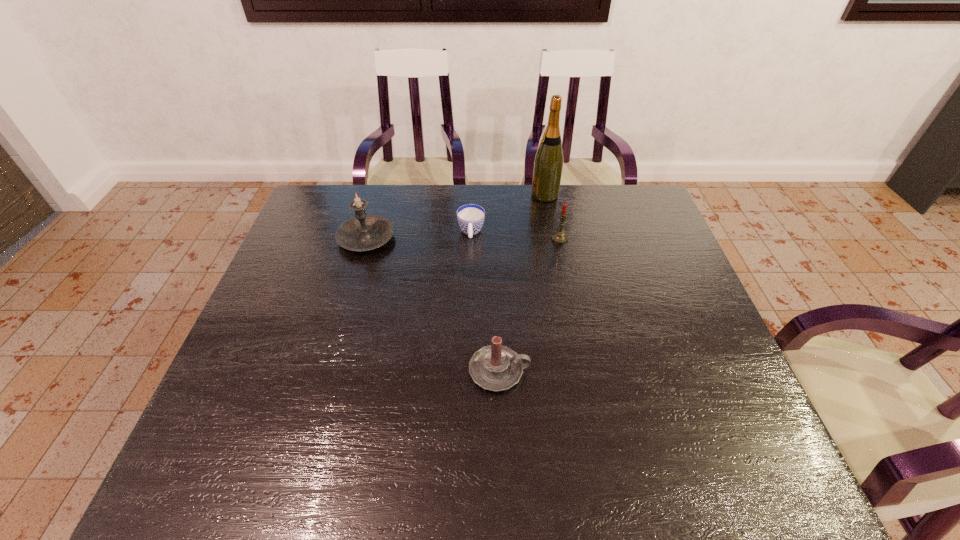
Where is `blank region between the tallest object and the rightmost candle`? blank region between the tallest object and the rightmost candle is located at coordinates (552, 217).

Identify the location of blank region between the nearest candle and the farthest object. (522, 283).

What are the coordinates of `vacant point located between the tallest object and the shortest object` in the screenshot? It's located at (508, 214).

Image resolution: width=960 pixels, height=540 pixels. Identify the location of vacant area that lies between the nearest object and the cup. (485, 302).

Image resolution: width=960 pixels, height=540 pixels. What are the coordinates of `unoccupied position between the rightmost candle and the tallest candle` in the screenshot? It's located at (463, 239).

You are a GUI agent. You are given a task and a screenshot of the screen. Output one action in this format:
    pyautogui.click(x=<x>, y=<y>)
    Task: Click on the vacant point located between the leftmost candle and the rightmost candle
    Image resolution: width=960 pixels, height=540 pixels.
    Given the screenshot: What is the action you would take?
    pyautogui.click(x=463, y=239)

Identify which object is located as the nearest to the fourth shortest object. Please provide its 2D coordinates. Your answer should be formatted as a tuple, i.e. [(x, y)], where the tuple contains the x and y coordinates of a point satisfying the conditions above.

[(470, 217)]

Identify which object is the second closest to the shortest object. Please provide its 2D coordinates. Your answer should be formatted as a tuple, i.e. [(x, y)], where the tuple contains the x and y coordinates of a point satisfying the conditions above.

[(363, 232)]

Locate which candle is the closest to the tallest candle. Please provide its 2D coordinates. Your answer should be formatted as a tuple, i.e. [(x, y)], where the tuple contains the x and y coordinates of a point satisfying the conditions above.

[(496, 368)]

Find the location of `candle that is the second closest one to the nearest candle`. candle that is the second closest one to the nearest candle is located at coordinates (363, 232).